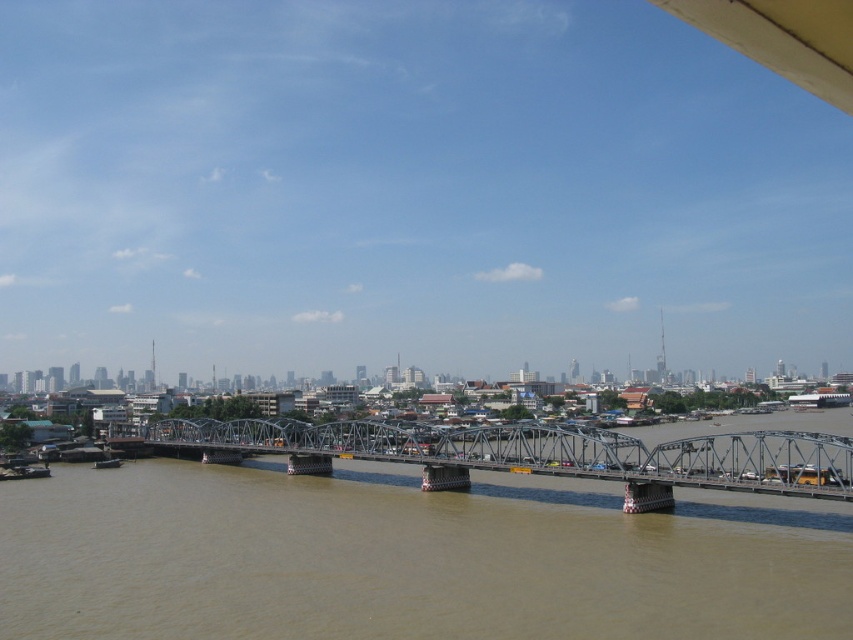
Question: Is brown sedimentary river at center to the right of metallic steel bridge at center from the viewer's perspective?

Choices:
 (A) yes
 (B) no

Answer: (B)

Question: Is brown sedimentary river at center bigger than metallic steel bridge at center?

Choices:
 (A) no
 (B) yes

Answer: (A)

Question: Can you confirm if brown sedimentary river at center is positioned above metallic steel bridge at center?

Choices:
 (A) yes
 (B) no

Answer: (B)